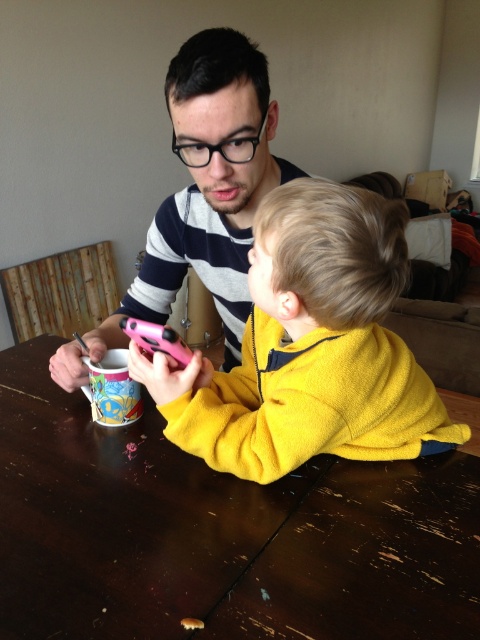
From the picture: Is multicolored plastic cup at lower left above pink plastic phone at center?

No.

Which is above, multicolored plastic cup at lower left or pink plastic phone at center?

Positioned higher is pink plastic phone at center.

The width and height of the screenshot is (480, 640). In order to click on multicolored plastic cup at lower left in this screenshot , I will do `click(112, 388)`.

Does point (152, 440) come behind point (257, 176)?

Yes, point (152, 440) is farther from viewer.

Can you confirm if wooden table at center is bigger than matte striped sweater at upper center?

Yes, wooden table at center is bigger than matte striped sweater at upper center.

You are a GUI agent. You are given a task and a screenshot of the screen. Output one action in this format:
    pyautogui.click(x=<x>, y=<y>)
    Task: Click on the wooden table at center
    The height and width of the screenshot is (640, 480).
    Given the screenshot: What is the action you would take?
    pyautogui.click(x=217, y=532)

Can you confirm if yellow fleece jacket at center is shorter than matte striped sweater at upper center?

Correct, yellow fleece jacket at center is not as tall as matte striped sweater at upper center.

Between yellow fleece jacket at center and matte striped sweater at upper center, which one is positioned lower?

yellow fleece jacket at center is below.

Who is more distant from viewer, (x=335, y=186) or (x=194, y=264)?

The point (x=194, y=264) is behind.

You are a GUI agent. You are given a task and a screenshot of the screen. Output one action in this format:
    pyautogui.click(x=<x>, y=<y>)
    Task: Click on the yellow fleece jacket at center
    
    Given the screenshot: What is the action you would take?
    pyautogui.click(x=310, y=346)